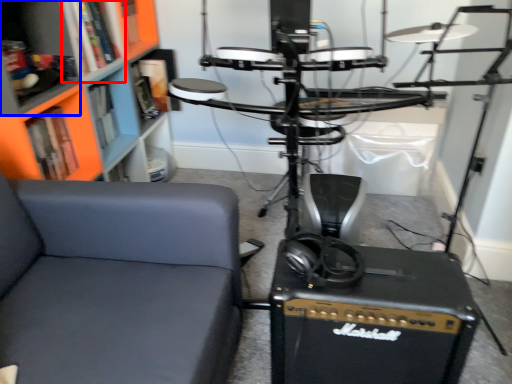
Question: Among these objects, which one is nearest to the camera, shelf (highlighted by a red box) or shelf (highlighted by a blue box)?

Choices:
 (A) shelf
 (B) shelf

Answer: (B)